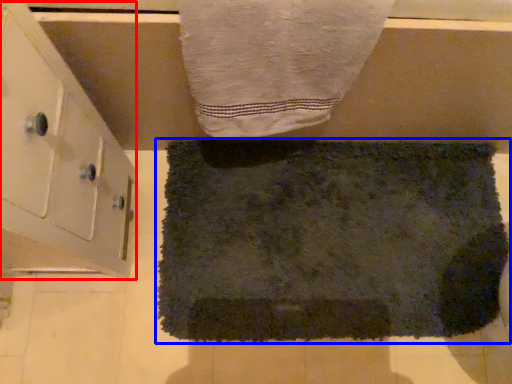
Question: Which point is closer to the camera, cabinetry (highlighted by a red box) or towel (highlighted by a blue box)?

Choices:
 (A) cabinetry
 (B) towel

Answer: (A)